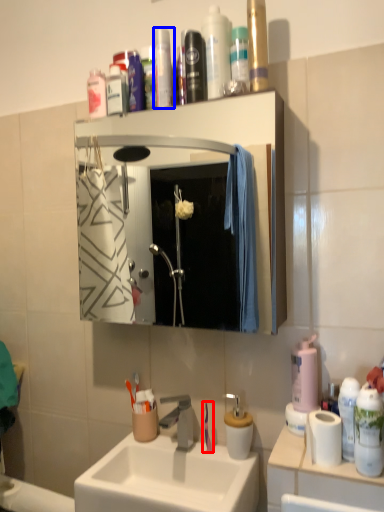
Question: Which object is closer to the camera taking this photo, toothbrush (highlighted by a red box) or toiletry (highlighted by a blue box)?

Choices:
 (A) toothbrush
 (B) toiletry

Answer: (B)